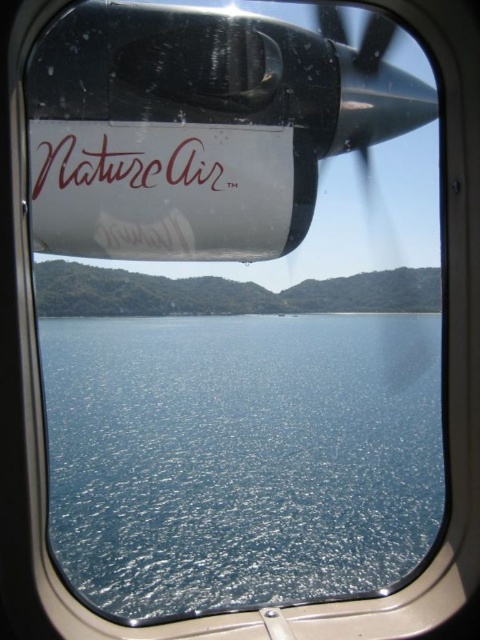
Is blue glossy water at center positioned before browncursive text at center?

Yes, blue glossy water at center is closer to the viewer.

The height and width of the screenshot is (640, 480). What do you see at coordinates (240, 458) in the screenshot?
I see `blue glossy water at center` at bounding box center [240, 458].

Image resolution: width=480 pixels, height=640 pixels. Describe the element at coordinates (240, 458) in the screenshot. I see `blue glossy water at center` at that location.

The width and height of the screenshot is (480, 640). What are the coordinates of `blue glossy water at center` in the screenshot? It's located at (240, 458).